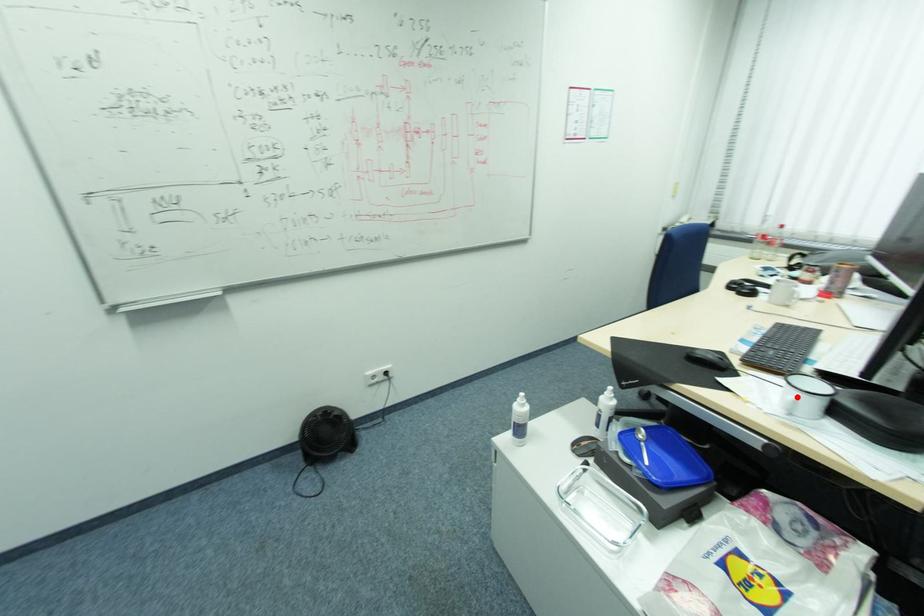
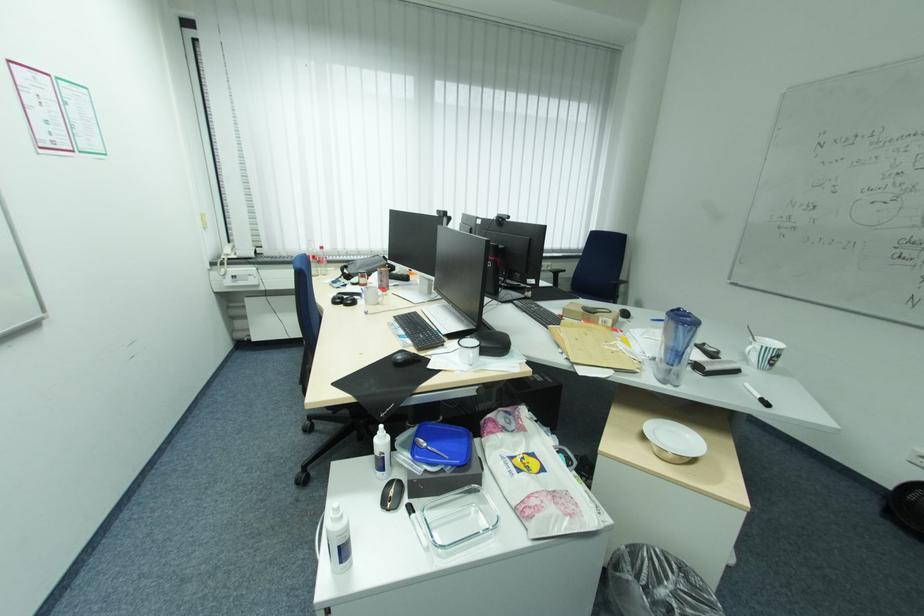
Where in the second image is the point corresponding to the highlighted location from the first image?

(478, 355)